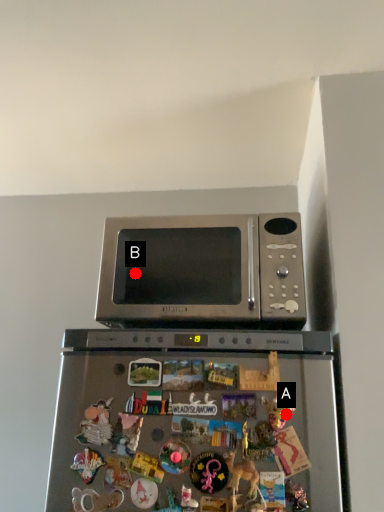
Question: Two points are circled on the image, labeled by A and B beside each circle. Which point is closer to the camera taking this photo?

Choices:
 (A) A is closer
 (B) B is closer

Answer: (A)